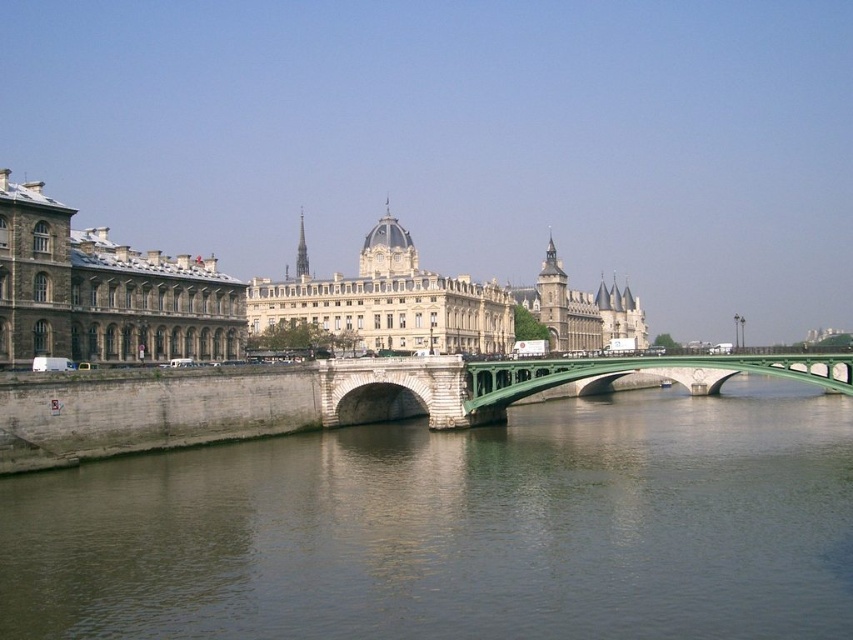
You are a boat captain planning to navigate a vessel through the green stone river at center. The stone building at left is on your left side. Can you determine if the river is wide enough for your boat to pass safely without hitting the building?

The green stone river at center might be wider than stone building at left, so there is a possibility that the river is wide enough for the boat to pass safely without hitting the building. However, further measurements or confirmation would be needed to ensure safety.